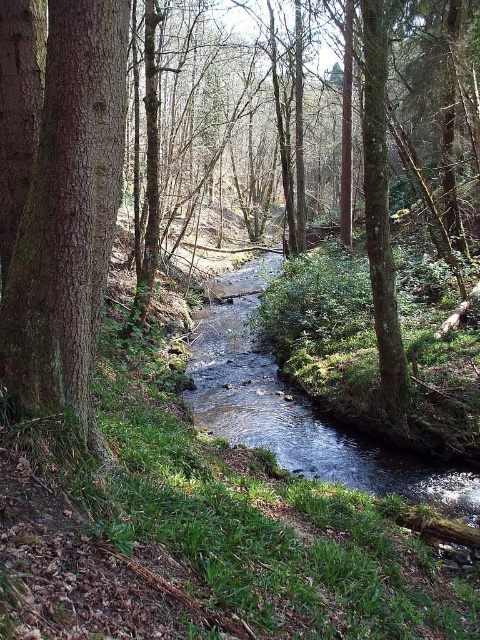
Question: Which point is farther to the camera?

Choices:
 (A) (115, 99)
 (B) (70, 372)

Answer: (A)

Question: Is brown rough tree at center wider than clear water at center?

Choices:
 (A) no
 (B) yes

Answer: (A)

Question: Which of the following is the farthest from the observer?

Choices:
 (A) (74, 29)
 (B) (255, 378)
 (C) (22, 280)

Answer: (B)

Question: Can you confirm if brown rough tree at center is positioned to the right of smooth brown tree trunk at left?

Choices:
 (A) no
 (B) yes

Answer: (B)

Question: Is brown rough tree at center wider than smooth brown tree trunk at left?

Choices:
 (A) yes
 (B) no

Answer: (B)

Question: Which point is farther to the camera?

Choices:
 (A) 48,266
 (B) 398,460

Answer: (B)